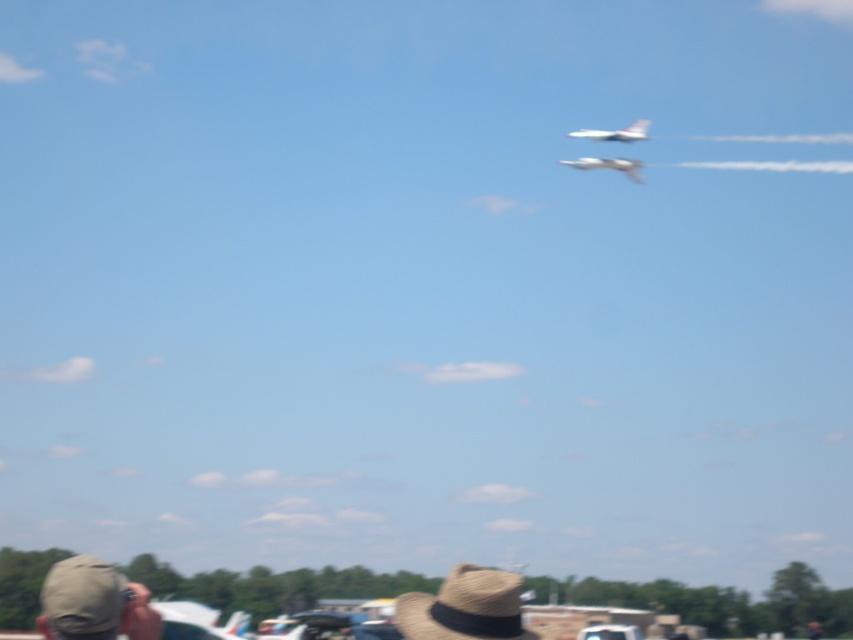
Is white matte airplane at upper center positioned before white glossy airplane at upper center?

No, it is behind white glossy airplane at upper center.

Between white matte airplane at upper center and white glossy airplane at upper center, which one appears on the right side from the viewer's perspective?

white matte airplane at upper center is more to the right.

Describe the element at coordinates (614, 132) in the screenshot. I see `white matte airplane at upper center` at that location.

Where is `white matte airplane at upper center`? The width and height of the screenshot is (853, 640). white matte airplane at upper center is located at coordinates (614, 132).

Is point (91, 618) closer to camera compared to point (642, 128)?

Yes, point (91, 618) is in front of point (642, 128).

Can you confirm if khaki fabric cap at lower left is positioned above white matte airplane at upper center?

Actually, khaki fabric cap at lower left is below white matte airplane at upper center.

Locate an element on the screen. This screenshot has height=640, width=853. khaki fabric cap at lower left is located at coordinates (93, 602).

This screenshot has height=640, width=853. I want to click on khaki fabric cap at lower left, so click(x=93, y=602).

Does point (454, 595) come behind point (596, 161)?

No.

Which is in front, point (492, 589) or point (558, 161)?

Positioned in front is point (492, 589).

The image size is (853, 640). Find the location of `straw textured cowboy hat at center`. straw textured cowboy hat at center is located at coordinates (465, 608).

What are the coordinates of `straw textured cowboy hat at center` in the screenshot? It's located at (465, 608).